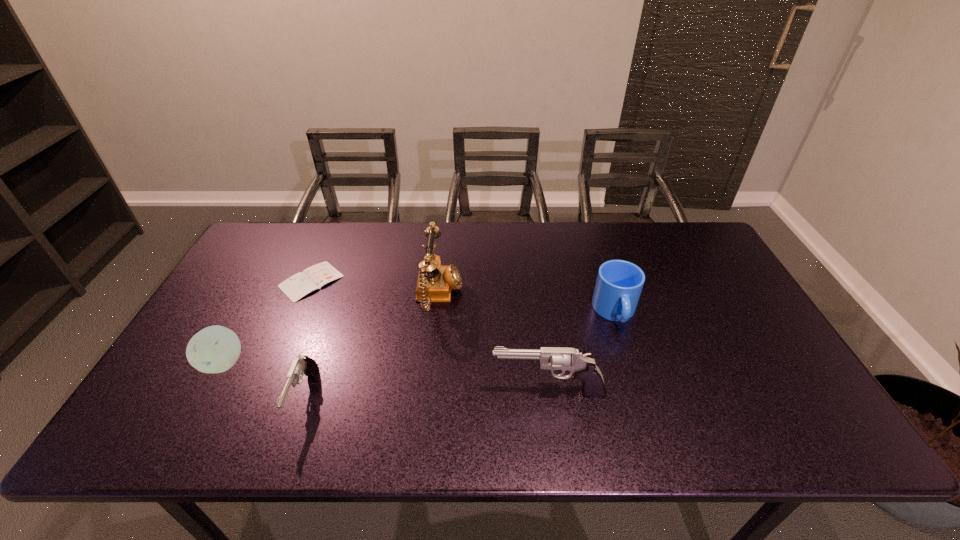
You are a GUI agent. You are given a task and a screenshot of the screen. Output one action in this format:
    pyautogui.click(x=<x>, y=<y>)
    Task: Click on the vacant space located at the muzzle of the second tallest object
    Image resolution: width=960 pixels, height=540 pixels.
    Given the screenshot: What is the action you would take?
    pyautogui.click(x=362, y=392)

Locate an element on the screen. The width and height of the screenshot is (960, 540). vacant area situated 0.160m on the back of the shortest object is located at coordinates (332, 233).

This screenshot has height=540, width=960. I want to click on vacant area situated 0.080m on the dial number of the telephone, so click(x=489, y=296).

Locate an element on the screen. free location located on the side of the rightmost object with the handle is located at coordinates (639, 388).

Find the location of a particular element. The height and width of the screenshot is (540, 960). free space located 0.070m on the right of the apple is located at coordinates (274, 363).

The height and width of the screenshot is (540, 960). In order to click on object at the far edge in this screenshot , I will do `click(297, 286)`.

Locate an element on the screen. The height and width of the screenshot is (540, 960). apple that is positioned at the near edge is located at coordinates (215, 349).

Where is `diary that is at the left edge`? diary that is at the left edge is located at coordinates (297, 286).

You are a GUI agent. You are given a task and a screenshot of the screen. Output one action in this format:
    pyautogui.click(x=<x>, y=<y>)
    Task: Click on the apple located at the left edge
    This screenshot has width=960, height=540.
    Given the screenshot: What is the action you would take?
    pyautogui.click(x=215, y=349)

Identify the location of object located at the far left corner. (297, 286).